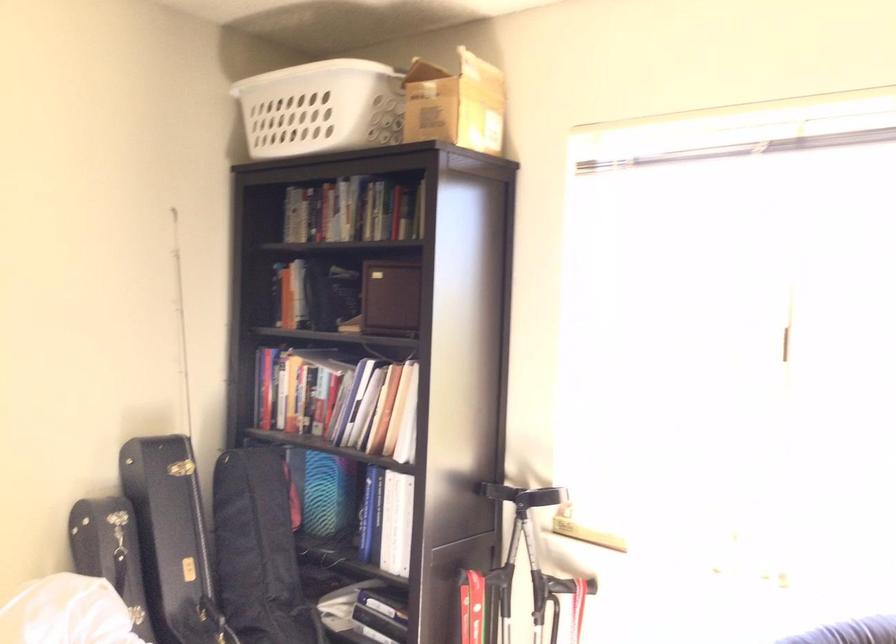
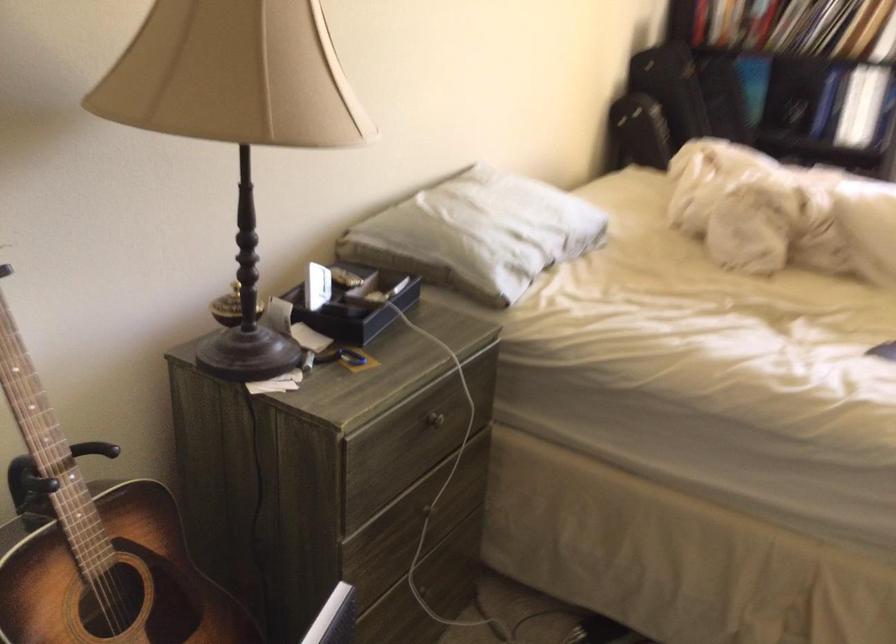
Question: The images are taken continuously from a first-person perspective. In which direction are you moving?

Choices:
 (A) Left
 (B) Right
 (C) Forward
 (D) Backward

Answer: (A)